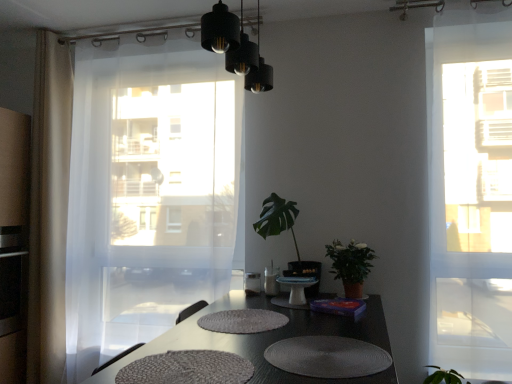
The height and width of the screenshot is (384, 512). Identify the location of free spot below white textured placemat at lower center, the 2th wide viewed from the left (from a real-world perspective). (324, 360).